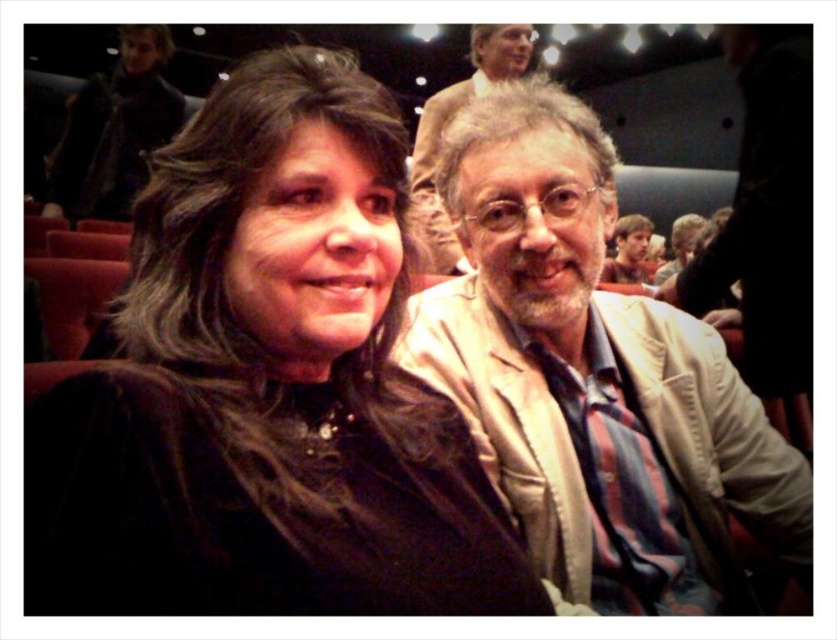
You are a photographer standing at the back of the theater. You want to take a photo of the black velvet jacket at center and the smooth brown hair at upper right. The minimum distance between the two subjects for a clear shot is 10 feet. Can you capture both in one frame without them overlapping?

The black velvet jacket at center is 9.13 feet from the smooth brown hair at upper right. Since the required minimum distance is 10 feet, the two subjects are too close to each other to be captured clearly without overlapping in a single frame.

You are a photographer in a theater setting. You need to place a small microphone stand exactly at the coordinates where the black velvet jacket at center is located. What are the coordinates where you should place the microphone stand?

The coordinates for the black velvet jacket at center are at point [266,388]. Therefore, the microphone stand should be placed at coordinates [266,388].